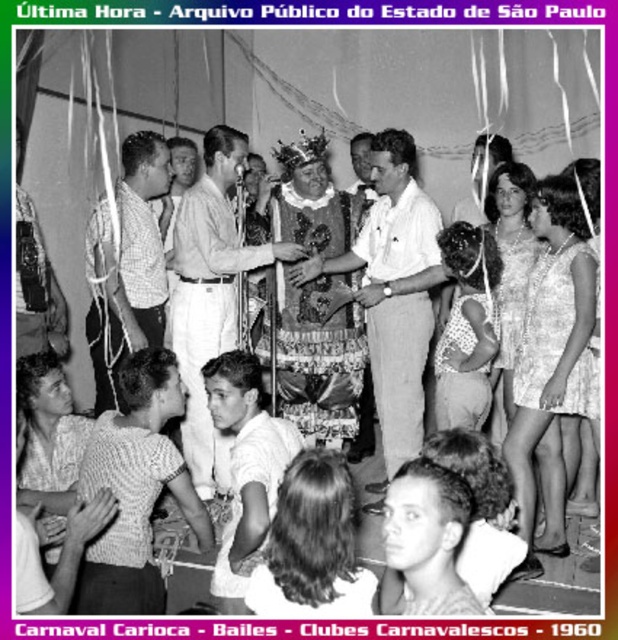
In the image of the 1960 Brazilian Carnival event, there is a person wearing a checkered shirt at center and another wearing a decorative fabric costume at center. From the perspective of someone standing at the front of the image, which clothing item is positioned to the left?

The checkered shirt at center is positioned to the left of the decorative fabric costume at center.

You are a photographer at the Carnaval Carioca event and want to capture a photo of both the light brown cotton shirt at center and the smooth white shirt at center. Which shirt should you focus on first if you want to include both in your shot without moving the camera?

The light brown cotton shirt at center is to the left of the smooth white shirt at center, so you should focus on the light brown cotton shirt at center first to ensure both shirts are captured in the frame.

You are a photographer at the event and need to capture a photo of both the smooth white shirt at center and the decorative fabric costume at center in the same frame. Given that your camera has a minimum focus distance of 3 feet, will you be able to take the photo without moving closer?

The distance between the smooth white shirt at center and the decorative fabric costume at center is 3.44 feet, which is greater than the camera minimum focus distance of 3 feet. Therefore, you can take the photo without moving closer.